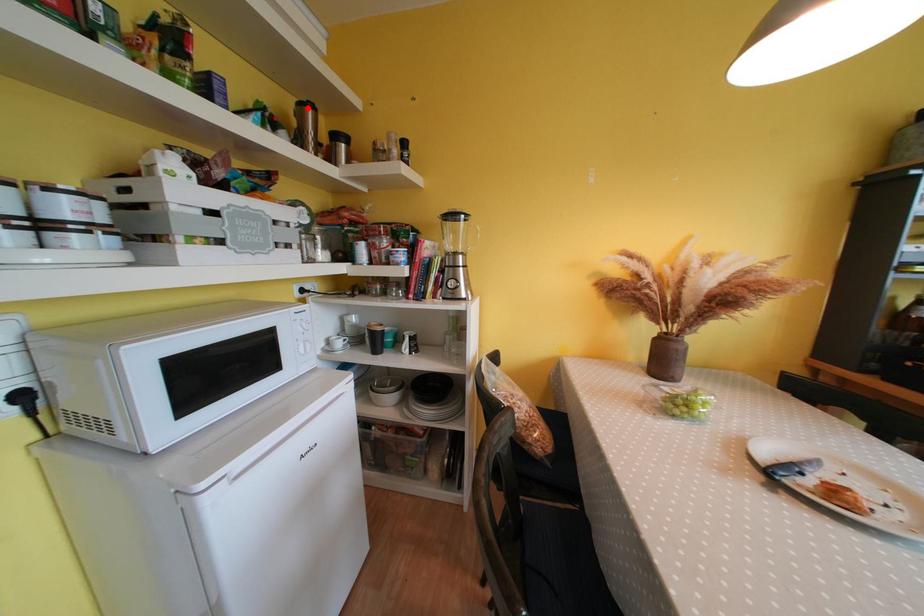
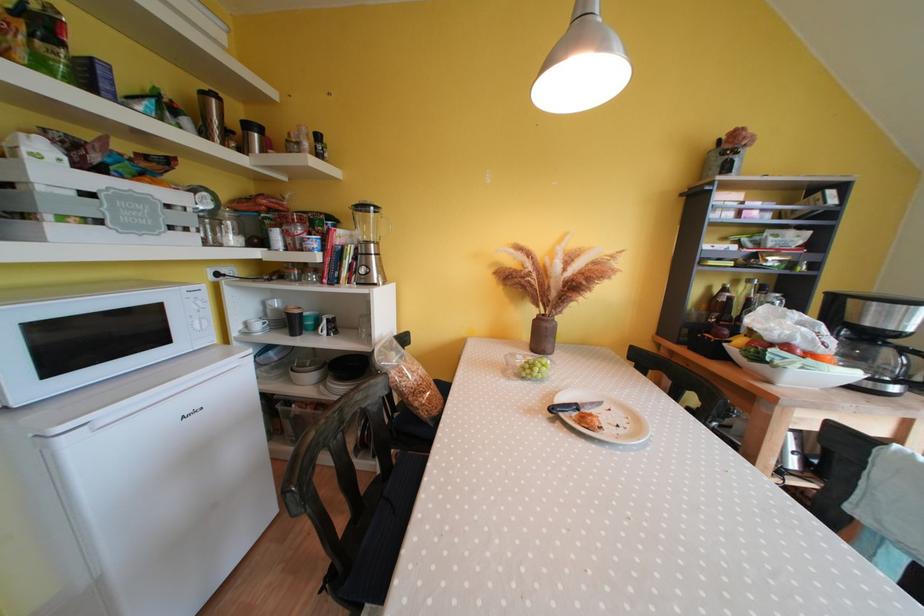
Locate, in the second image, the point that corresponds to the highlighted location in the first image.

(209, 98)